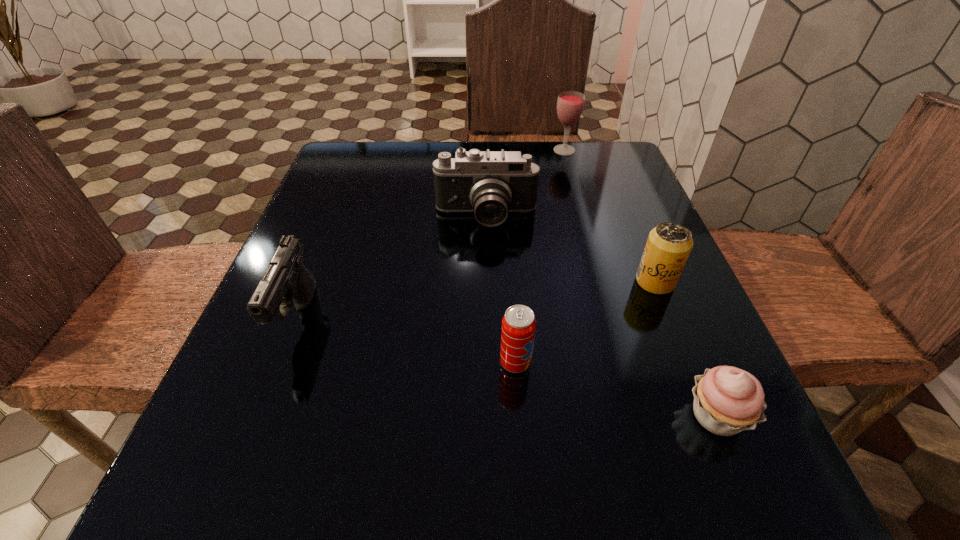
The image size is (960, 540). I want to click on vacant space at the near edge, so click(521, 460).

Locate an element on the screen. vacant space at the left edge is located at coordinates (238, 402).

Where is `vacant space at the right edge of the desktop`? vacant space at the right edge of the desktop is located at coordinates pos(603,216).

In the image, there is a desktop. Where is `free space at the far left corner`? The height and width of the screenshot is (540, 960). free space at the far left corner is located at coordinates (350, 156).

The width and height of the screenshot is (960, 540). I want to click on free point at the far right corner, so click(600, 188).

This screenshot has width=960, height=540. Identify the location of free space between the soda can and the fifth nearest object. (501, 291).

The image size is (960, 540). Identify the location of free spot between the soda can and the pistol. (407, 340).

The image size is (960, 540). I want to click on empty space between the pistol and the soda can, so click(407, 340).

The height and width of the screenshot is (540, 960). What are the coordinates of `free spot between the camera and the beer can` in the screenshot? It's located at (570, 250).

The image size is (960, 540). Find the location of `free space between the second farthest object and the soda can`. free space between the second farthest object and the soda can is located at coordinates (501, 291).